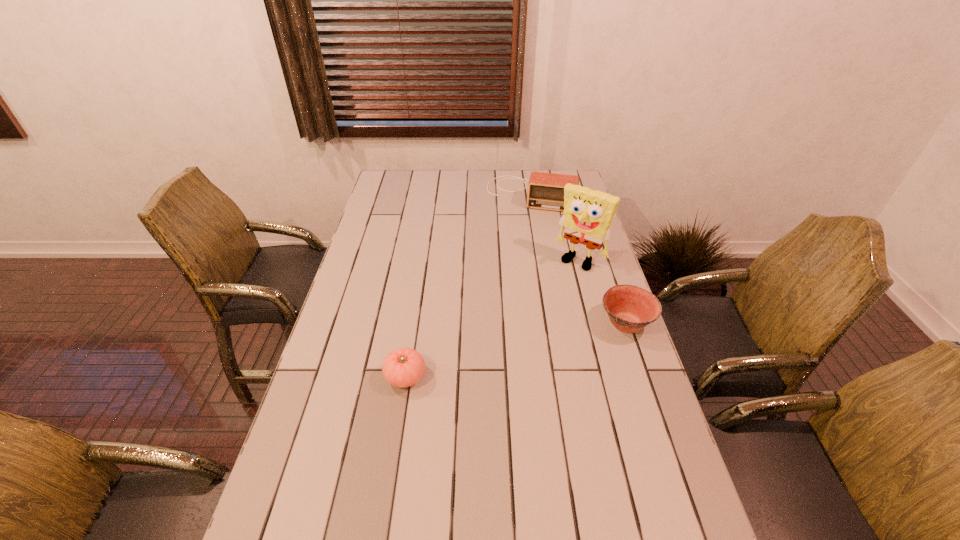
At what (x,y) coordinates should I click in order to perform the action: click on free space located 0.310m on the front-facing side of the farthest object. Please return your answer as a coordinate pair (x, y). Looking at the image, I should click on (514, 260).

Image resolution: width=960 pixels, height=540 pixels. In order to click on free point located on the front-facing side of the farthest object in this screenshot , I will do `click(517, 244)`.

This screenshot has width=960, height=540. In order to click on free point located on the face of the sponge in this screenshot , I will do `click(541, 308)`.

What are the coordinates of `vacant space positioned on the face of the sponge` in the screenshot? It's located at (550, 297).

I want to click on vacant point located 0.180m on the face of the sponge, so click(547, 301).

In order to click on object that is at the far edge in this screenshot , I will do `click(545, 190)`.

Image resolution: width=960 pixels, height=540 pixels. I want to click on bowl present at the right edge, so click(630, 308).

The height and width of the screenshot is (540, 960). I want to click on radio receiver that is at the right edge, so click(545, 190).

Locate an element on the screen. Image resolution: width=960 pixels, height=540 pixels. sponge that is at the right edge is located at coordinates (588, 214).

Find the location of a particular element. object located in the far right corner section of the desktop is located at coordinates (545, 190).